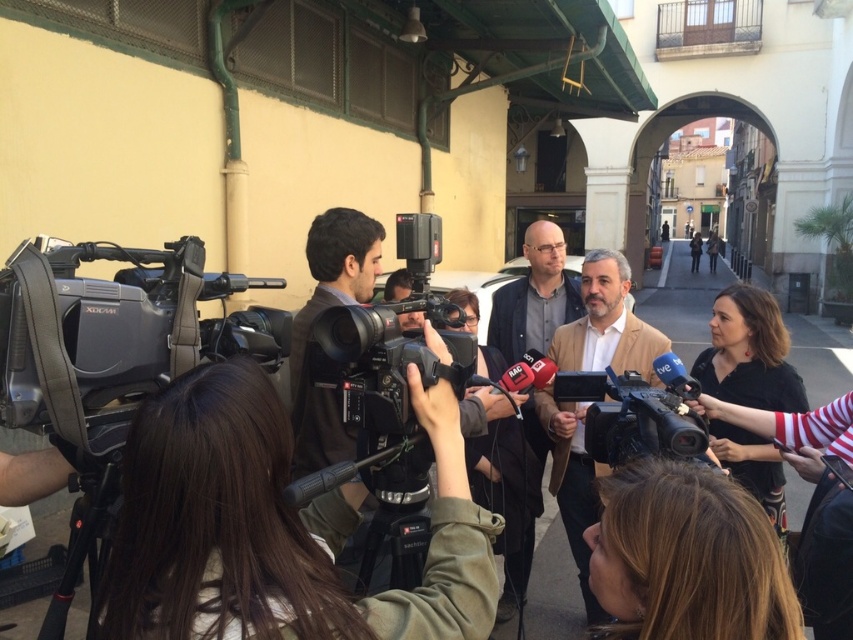
You are a photographer at the event and need to position yourself between the black plastic camera at center and the matte brown jacket at center. Which direction should you move to stay between them?

You should move to the right of the black plastic camera at center since it is to the left of the matte brown jacket at center, placing you between them.

You are a photographer standing at the origin point of the coordinate system. You need to move to the location of the black matte camera at center to adjust its settings. What are the coordinates you need to move to?

The coordinates to move to are 0.566 on the x axis and 0.449 on the y axis, as the black matte camera at center is located at point (381, 362).

You are a technician carrying a 1.5 meter long equipment case. You need to move it from the black matte camera at center to the camera. Is there enough space to move the case without tilting it sideways?

The distance between the black matte camera at center and the camera is 1.43 meters. Since the equipment case is 1.5 meters long, it is longer than the available space. Therefore, you cannot move the case without tilting it sideways to reduce its length.